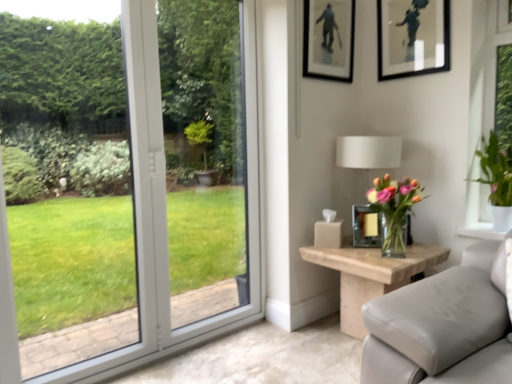
The width and height of the screenshot is (512, 384). Identify the location of white fabric lampshade at upper right. coord(368,152).

How much space does green leafy plant at right, arranged as the second houseplant when viewed from the left, occupy vertically?

It is 56.59 centimeters.

Describe the element at coordinates (370, 275) in the screenshot. I see `natural wood side table at right` at that location.

Image resolution: width=512 pixels, height=384 pixels. Find the location of `translucent glass vase at right, the 2th houseplant positioned from the right`. translucent glass vase at right, the 2th houseplant positioned from the right is located at coordinates (394, 209).

Can you confirm if matte black picture frame at upper center, positioned as the first picture frame in left-to-right order, is smaller than green leafy plant at right, which is the first houseplant in right-to-left order?

Yes, matte black picture frame at upper center, positioned as the first picture frame in left-to-right order, is smaller than green leafy plant at right, which is the first houseplant in right-to-left order.

From the image's perspective, which object appears higher, matte black picture frame at upper center, which is the 3th picture frame from right to left, or green leafy plant at right, which is the first houseplant in right-to-left order?

matte black picture frame at upper center, which is the 3th picture frame from right to left, is shown above in the image.

Is point (348, 32) positioned in front of point (480, 156)?

That is False.

Is matte black picture frame at upper center, which is the 3th picture frame from right to left, surrounding green leafy plant at right, which is the first houseplant in right-to-left order?

No, green leafy plant at right, which is the first houseplant in right-to-left order, is located outside of matte black picture frame at upper center, which is the 3th picture frame from right to left.

Considering the relative positions of matte black picture frame at upper center, positioned as the first picture frame in left-to-right order, and translucent glass vase at right, the 2th houseplant positioned from the right, in the image provided, is matte black picture frame at upper center, positioned as the first picture frame in left-to-right order, behind translucent glass vase at right, the 2th houseplant positioned from the right,?

Yes, the depth of matte black picture frame at upper center, positioned as the first picture frame in left-to-right order, is greater than that of translucent glass vase at right, the 2th houseplant positioned from the right.

I want to click on the 1st picture frame located above the translucent glass vase at right, placed as the 1th houseplant when sorted from left to right (from a real-world perspective), so click(x=328, y=39).

In the scene shown: Considering the sizes of objects matte black picture frame at upper center, marked as the second picture frame in a bottom-to-top arrangement, and translucent glass vase at right, placed as the 1th houseplant when sorted from left to right, in the image provided, who is smaller, matte black picture frame at upper center, marked as the second picture frame in a bottom-to-top arrangement, or translucent glass vase at right, placed as the 1th houseplant when sorted from left to right,?

Smaller between the two is matte black picture frame at upper center, marked as the second picture frame in a bottom-to-top arrangement.

Is natural wood side table at right oriented towards metallic gold picture frame at right, which is counted as the third picture frame, starting from the top?

No, natural wood side table at right is not oriented towards metallic gold picture frame at right, which is counted as the third picture frame, starting from the top.

Which is more to the left, natural wood side table at right or metallic gold picture frame at right, positioned as the 2th picture frame in right-to-left order?

Positioned to the left is metallic gold picture frame at right, positioned as the 2th picture frame in right-to-left order.

Is natural wood side table at right shorter than metallic gold picture frame at right, the second picture frame from the left?

In fact, natural wood side table at right may be taller than metallic gold picture frame at right, the second picture frame from the left.

Is point (362, 162) closer to camera compared to point (374, 273)?

No, it is not.

Does white fabric lampshade at upper right have a greater width compared to natural wood side table at right?

Incorrect, the width of white fabric lampshade at upper right does not surpass that of natural wood side table at right.

Is green leafy plant at right, which is the first houseplant in right-to-left order, at the right side of matte black picture frame at upper center, marked as the second picture frame in a bottom-to-top arrangement?

Yes.

Is matte black picture frame at upper center, marked as the second picture frame in a bottom-to-top arrangement, at the back of green leafy plant at right, arranged as the second houseplant when viewed from the left?

No.

Is green leafy plant at right, which is the first houseplant in right-to-left order, positioned beyond the bounds of matte black picture frame at upper center, which is counted as the 2th picture frame, starting from the top?

Yes, green leafy plant at right, which is the first houseplant in right-to-left order, is outside of matte black picture frame at upper center, which is counted as the 2th picture frame, starting from the top.

Considering the relative sizes of green leafy plant at right, arranged as the second houseplant when viewed from the left, and matte black picture frame at upper center, marked as the second picture frame in a bottom-to-top arrangement, in the image provided, is green leafy plant at right, arranged as the second houseplant when viewed from the left, shorter than matte black picture frame at upper center, marked as the second picture frame in a bottom-to-top arrangement,?

In fact, green leafy plant at right, arranged as the second houseplant when viewed from the left, may be taller than matte black picture frame at upper center, marked as the second picture frame in a bottom-to-top arrangement.

Which point is more distant from viewer, [359,218] or [409,249]?

Point [359,218]

How distant is metallic gold picture frame at right, positioned as the 2th picture frame in right-to-left order, from natural wood side table at right?

21.02 centimeters.

Considering the relative sizes of metallic gold picture frame at right, the second picture frame from the left, and natural wood side table at right in the image provided, is metallic gold picture frame at right, the second picture frame from the left, wider than natural wood side table at right?

No, metallic gold picture frame at right, the second picture frame from the left, is not wider than natural wood side table at right.

What's the angular difference between natural wood side table at right and matte black picture frame at upper center, positioned as the first picture frame in left-to-right order,'s facing directions?

The facing directions of natural wood side table at right and matte black picture frame at upper center, positioned as the first picture frame in left-to-right order, are 90 degrees apart.

Is natural wood side table at right far away from matte black picture frame at upper center, positioned as the first picture frame in left-to-right order?

natural wood side table at right is positioned a significant distance from matte black picture frame at upper center, positioned as the first picture frame in left-to-right order.

Which object is closer to the camera taking this photo, natural wood side table at right or matte black picture frame at upper center, positioned as the first picture frame in left-to-right order?

natural wood side table at right is closer to the camera.

Measure the distance between natural wood side table at right and matte black picture frame at upper center, which is counted as the 2th picture frame, starting from the top.

The distance of natural wood side table at right from matte black picture frame at upper center, which is counted as the 2th picture frame, starting from the top, is 1.20 meters.

From the matte black picture frame at upper center, which is the 3th picture frame from right to left, count 2nd houseplant to the right and point to it. Please provide its 2D coordinates.

[(497, 179)]

Find the location of a particular element. This screenshot has height=384, width=512. the 1st picture frame positioned above the translucent glass vase at right, placed as the 1th houseplant when sorted from left to right (from a real-world perspective) is located at coordinates [x=328, y=39].

Looking at the image, which one is located further to green leafy plant at right, which is the first houseplant in right-to-left order, matte black picture frame at upper center, positioned as the first picture frame in left-to-right order, or translucent glass vase at right, the 2th houseplant positioned from the right?

matte black picture frame at upper center, positioned as the first picture frame in left-to-right order.

When comparing their distances from matte black picture frame at upper right, the third picture frame from the left, does green leafy plant at right, arranged as the second houseplant when viewed from the left, or metallic gold picture frame at right, which is counted as the third picture frame, starting from the top, seem further?

metallic gold picture frame at right, which is counted as the third picture frame, starting from the top, is positioned further to the anchor matte black picture frame at upper right, the third picture frame from the left.

Looking at this image, looking at the image, which one is located closer to natural wood side table at right, matte black picture frame at upper center, which is counted as the 2th picture frame, starting from the top, or white fabric lampshade at upper right?

Among the two, white fabric lampshade at upper right is located nearer to natural wood side table at right.

From the image, which object appears to be nearer to natural wood side table at right, metallic gold picture frame at right, the second picture frame from the left, or matte black picture frame at upper right, which is counted as the first picture frame, starting from the right?

Based on the image, metallic gold picture frame at right, the second picture frame from the left, appears to be nearer to natural wood side table at right.

Looking at the image, which one is located further to translucent glass vase at right, the 2th houseplant positioned from the right, matte black picture frame at upper center, positioned as the first picture frame in left-to-right order, or metallic gold picture frame at right, which is counted as the third picture frame, starting from the top?

Among the two, matte black picture frame at upper center, positioned as the first picture frame in left-to-right order, is located further to translucent glass vase at right, the 2th houseplant positioned from the right.

Which object lies nearer to the anchor point translucent glass vase at right, the 2th houseplant positioned from the right, natural wood side table at right or white fabric lampshade at upper right?

Among the two, natural wood side table at right is located nearer to translucent glass vase at right, the 2th houseplant positioned from the right.

Considering their positions, is matte black picture frame at upper center, positioned as the first picture frame in left-to-right order, positioned closer to metallic gold picture frame at right, which is counted as the third picture frame, starting from the top, than green leafy plant at right, arranged as the second houseplant when viewed from the left?

green leafy plant at right, arranged as the second houseplant when viewed from the left, is closer to metallic gold picture frame at right, which is counted as the third picture frame, starting from the top.

From the image, which object appears to be farther from matte black picture frame at upper right, the 3th picture frame ordered from the bottom, translucent glass vase at right, placed as the 1th houseplant when sorted from left to right, or natural wood side table at right?

natural wood side table at right.

This screenshot has height=384, width=512. What are the coordinates of `houseplant between matte black picture frame at upper right, the 3th picture frame ordered from the bottom, and white fabric lampshade at upper right from top to bottom` in the screenshot? It's located at (497, 179).

Identify the location of picture frame between matte black picture frame at upper right, the third picture frame from the left, and white fabric lampshade at upper right vertically. (328, 39).

Locate an element on the screen. This screenshot has width=512, height=384. picture frame between translucent glass vase at right, placed as the 1th houseplant when sorted from left to right, and natural wood side table at right, in the vertical direction is located at coordinates (x=362, y=227).

Where is `table lamp between matte black picture frame at upper center, positioned as the first picture frame in left-to-right order, and natural wood side table at right, in the vertical direction`? The image size is (512, 384). table lamp between matte black picture frame at upper center, positioned as the first picture frame in left-to-right order, and natural wood side table at right, in the vertical direction is located at coordinates (368, 152).